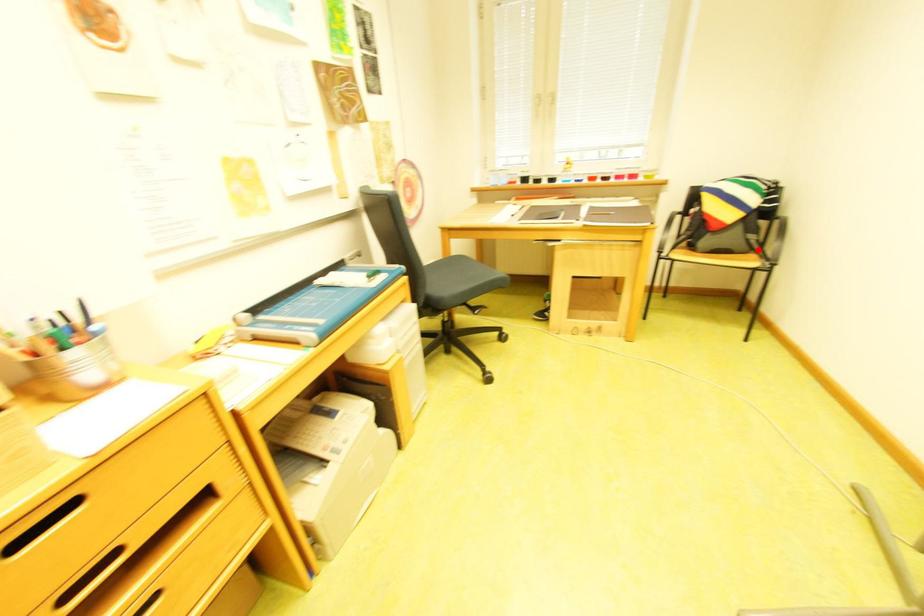
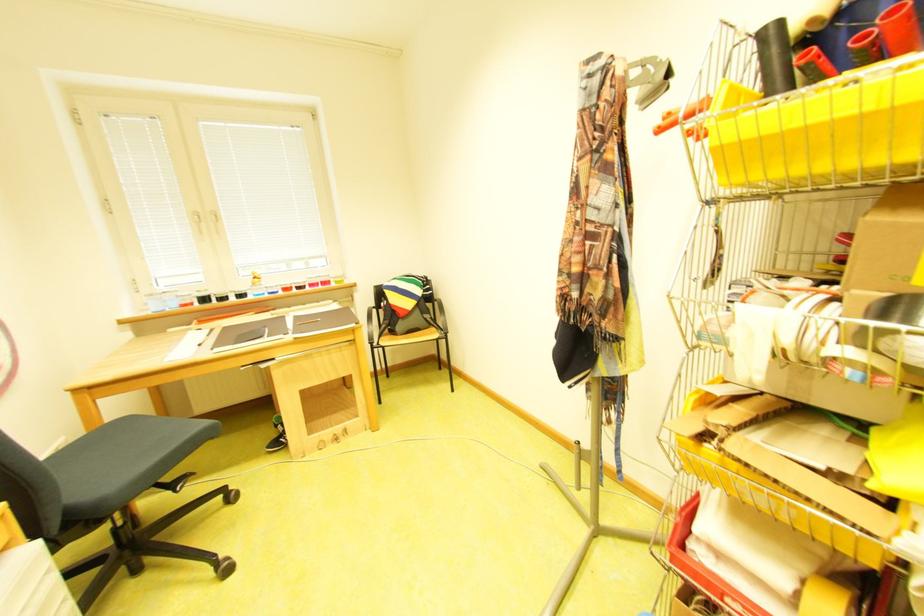
Question: A red point is marked in image1. In image2, is the corresponding 3D point closer to the camera or farther? Reply with the corresponding letter.

Choices:
 (A) The corresponding 3D point is closer.
 (B) The corresponding 3D point is farther.

Answer: (B)